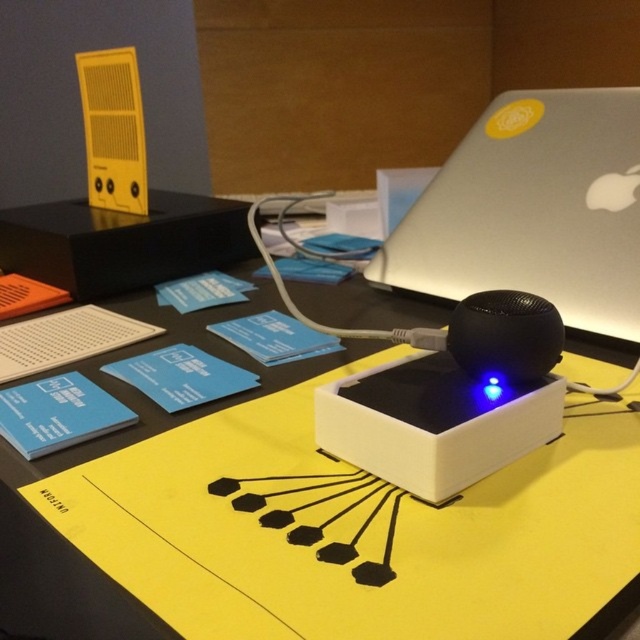
You are trying to reach a point marked at coordinates point (588, 413) on your desk. If your hand can extend 18 inches, will you be able to reach it without moving your chair?

The point (588, 413) is 19.11 inches away from the camera, which is slightly beyond your hand extension of 18 inches. Therefore, you would need to move your chair closer to reach it.

You are organizing items on the yellow matte table at center and the silver metallic laptop at upper right. If you need to place a rectangular box that is 12 inches wide, which surface can accommodate it without exceeding its width?

The yellow matte table at center is wider than the silver metallic laptop at upper right, so the rectangular box can be placed on the yellow matte table at center.